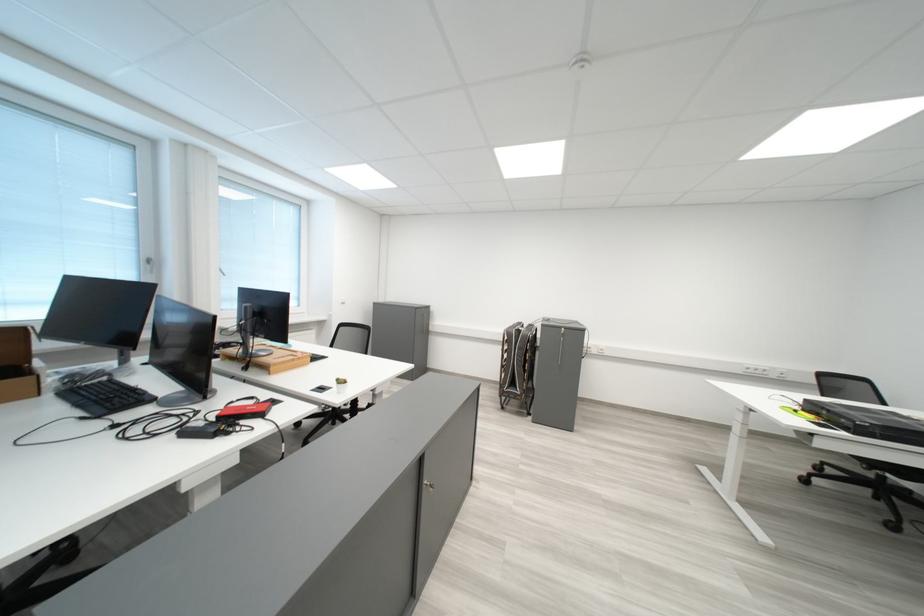
This screenshot has height=616, width=924. I want to click on white window handle, so click(149, 261).